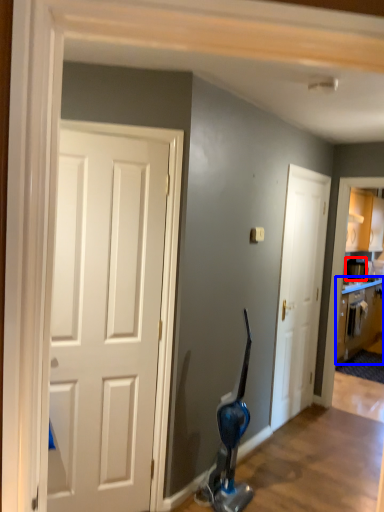
Question: Which of the following is the farthest to the observer, appliance (highlighted by a red box) or cabinetry (highlighted by a blue box)?

Choices:
 (A) appliance
 (B) cabinetry

Answer: (A)